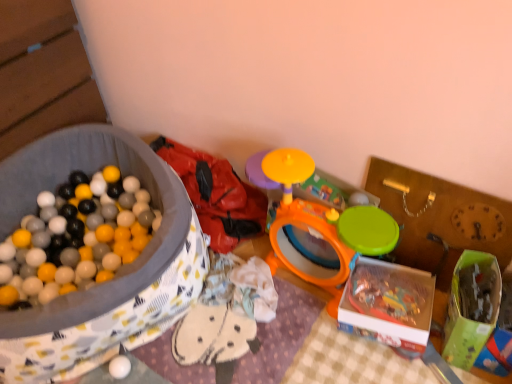
Question: Can you confirm if green plastic storage box at center-right, which is the third storage box from left to right, is smaller than rubberized red jacket at upper left, which appears as the 2th toy when viewed from the left?

Choices:
 (A) yes
 (B) no

Answer: (A)

Question: Is green plastic storage box at center-right, which is the third storage box from left to right, shorter than rubberized red jacket at upper left, which appears as the 2th toy when viewed from the left?

Choices:
 (A) yes
 (B) no

Answer: (B)

Question: Is the surface of green plastic storage box at center-right, which is the third storage box from left to right, in direct contact with rubberized red jacket at upper left, which appears as the 2th toy when viewed from the left?

Choices:
 (A) no
 (B) yes

Answer: (A)

Question: From the image's perspective, is green plastic storage box at center-right, which is the third storage box from left to right, below rubberized red jacket at upper left, positioned as the second toy in right-to-left order?

Choices:
 (A) yes
 (B) no

Answer: (A)

Question: Is green plastic storage box at center-right, which is the third storage box from left to right, facing away from rubberized red jacket at upper left, which appears as the 2th toy when viewed from the left?

Choices:
 (A) yes
 (B) no

Answer: (B)

Question: Is point (116, 375) closer or farther from the camera than point (22, 205)?

Choices:
 (A) closer
 (B) farther

Answer: (A)

Question: Based on their sizes in the image, would you say white matte ball at lower left, the 1th toy in the left-to-right sequence, is bigger or smaller than matte fabric ball pit at left, positioned as the first storage box in left-to-right order?

Choices:
 (A) small
 (B) big

Answer: (A)

Question: Based on their positions, is white matte ball at lower left, the 1th toy in the left-to-right sequence, located to the left or right of matte fabric ball pit at left, positioned as the first storage box in left-to-right order?

Choices:
 (A) left
 (B) right

Answer: (B)

Question: Is white matte ball at lower left, the 1th toy in the left-to-right sequence, inside or outside of matte fabric ball pit at left, positioned as the first storage box in left-to-right order?

Choices:
 (A) inside
 (B) outside

Answer: (A)

Question: In the image, is translucent plastic box at lower right, the second storage box from the left, positioned in front of or behind matte fabric ball pit at left, the third storage box in the right-to-left sequence?

Choices:
 (A) front
 (B) behind

Answer: (B)

Question: Visually, is translucent plastic box at lower right, the second storage box from the left, positioned to the left or to the right of matte fabric ball pit at left, the third storage box in the right-to-left sequence?

Choices:
 (A) right
 (B) left

Answer: (A)

Question: Looking at their shapes, would you say translucent plastic box at lower right, the second storage box from the right, is wider or thinner than matte fabric ball pit at left, the third storage box in the right-to-left sequence?

Choices:
 (A) thin
 (B) wide

Answer: (A)

Question: Do you think translucent plastic box at lower right, the second storage box from the left, is within matte fabric ball pit at left, the third storage box in the right-to-left sequence, or outside of it?

Choices:
 (A) outside
 (B) inside

Answer: (A)

Question: In the image, is green plastic storage box at center-right, which is the third storage box from left to right, on the left side or the right side of white matte ball at lower left, the 1th toy in the left-to-right sequence?

Choices:
 (A) left
 (B) right

Answer: (B)

Question: Considering the positions of green plastic storage box at center-right, which is the third storage box from left to right, and white matte ball at lower left, the 1th toy in the left-to-right sequence, in the image, is green plastic storage box at center-right, which is the third storage box from left to right, bigger or smaller than white matte ball at lower left, the 1th toy in the left-to-right sequence,?

Choices:
 (A) small
 (B) big

Answer: (B)